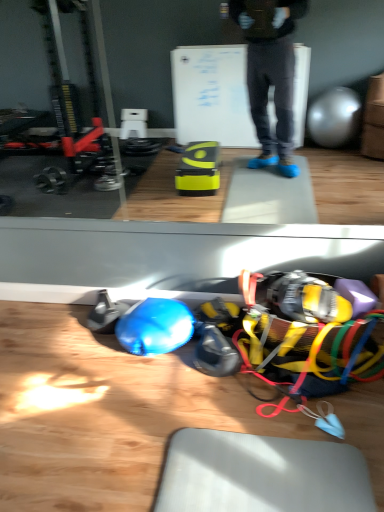
Find the location of a particular element. This screenshot has width=384, height=512. vacant area to the left of blue glossy helmet at lower left is located at coordinates (78, 351).